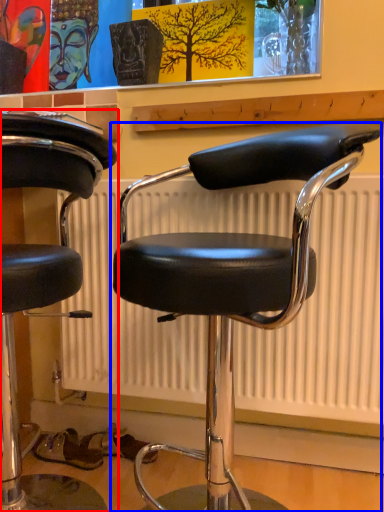
Question: Among these objects, which one is farthest to the camera, chair (highlighted by a red box) or chair (highlighted by a blue box)?

Choices:
 (A) chair
 (B) chair

Answer: (A)